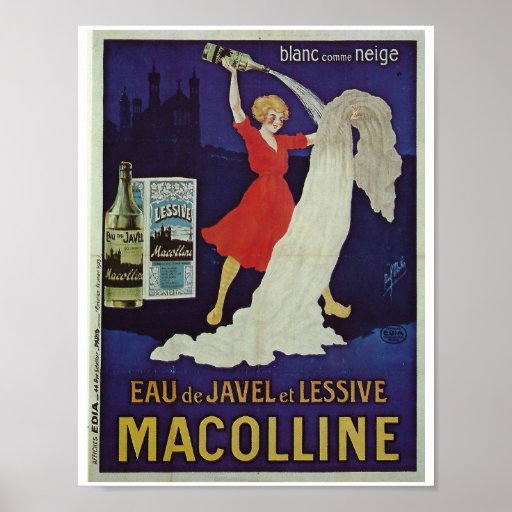
The image size is (512, 512). In order to click on box in this screenshot , I will do `click(164, 284)`.